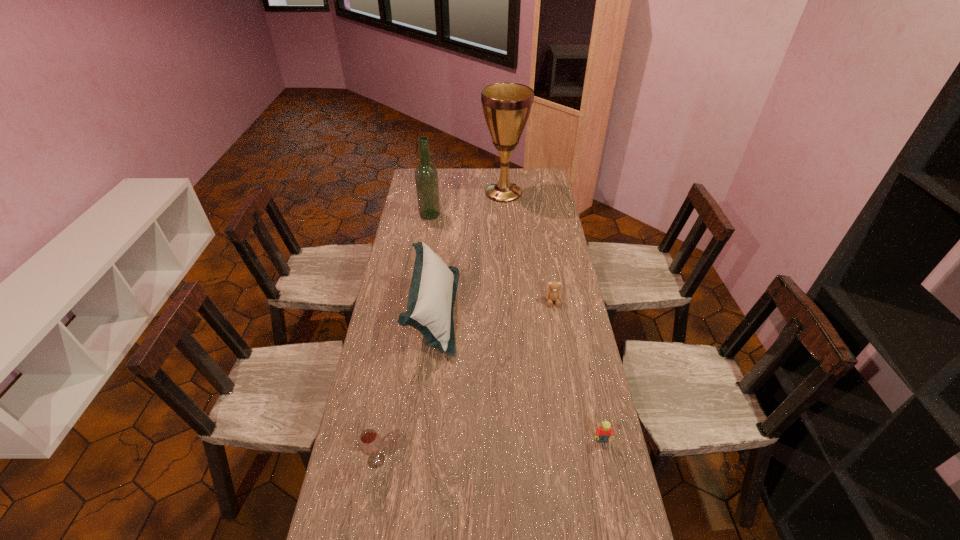
In order to click on the fourth object from left to right in this screenshot , I will do `click(506, 106)`.

At what (x,y) coordinates should I click in order to perform the action: click on the tallest object. Please return your answer as a coordinate pair (x, y). The width and height of the screenshot is (960, 540). Looking at the image, I should click on (506, 106).

This screenshot has width=960, height=540. In order to click on the fifth shortest object in this screenshot , I will do coord(426,176).

The height and width of the screenshot is (540, 960). In order to click on liquor in this screenshot , I will do `click(426, 176)`.

The height and width of the screenshot is (540, 960). In order to click on the fourth shortest object in this screenshot , I will do `click(433, 288)`.

Where is `the third shortest object`? The height and width of the screenshot is (540, 960). the third shortest object is located at coordinates (370, 443).

Find the location of a particular element. This screenshot has height=540, width=960. the nearest object is located at coordinates (370, 443).

Where is `the rightmost object`? the rightmost object is located at coordinates coord(605,431).

Find the location of a particular element. The image size is (960, 540). Lego is located at coordinates (605, 431).

This screenshot has height=540, width=960. Find the location of `teddy bear`. teddy bear is located at coordinates (553, 294).